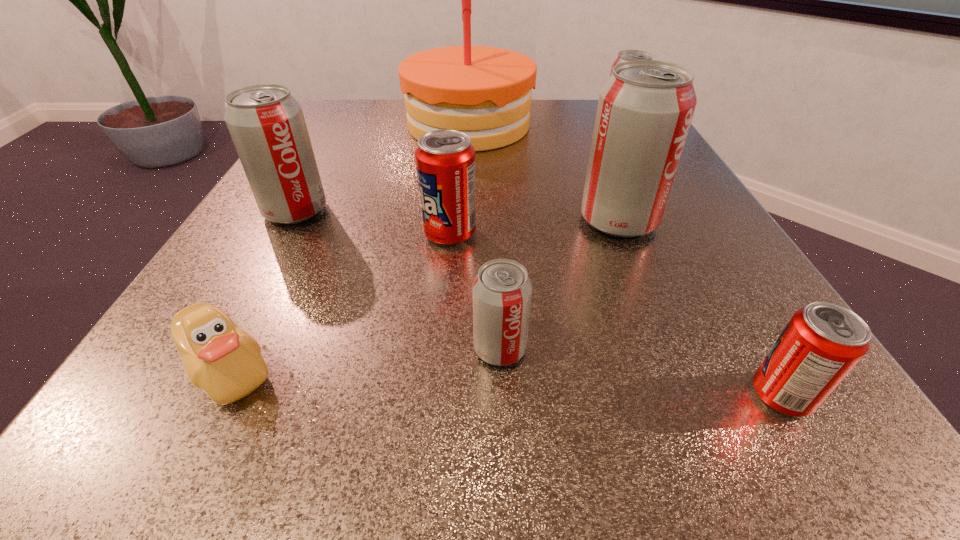
Where is `vacant position located 0.100m on the back of the right red soda can`? Image resolution: width=960 pixels, height=540 pixels. vacant position located 0.100m on the back of the right red soda can is located at coordinates (731, 308).

This screenshot has height=540, width=960. Identify the location of free location located on the front of the nearest gray soda can. (503, 417).

You are a GUI agent. You are given a task and a screenshot of the screen. Output one action in this format:
    pyautogui.click(x=<x>, y=<y>)
    Task: Click on the birthday cake that is at the far edge
    The height and width of the screenshot is (540, 960).
    Given the screenshot: What is the action you would take?
    pyautogui.click(x=485, y=92)

Where is `soda can located in the far edge section of the desktop`? soda can located in the far edge section of the desktop is located at coordinates (626, 55).

Find the location of a particular element. soda can located at the near edge is located at coordinates (822, 342).

You are a GUI agent. You are given a task and a screenshot of the screen. Output one action in this format:
    pyautogui.click(x=<x>, y=<y>)
    Task: Click on the duck that is at the near edge
    
    Given the screenshot: What is the action you would take?
    pyautogui.click(x=220, y=358)

Where is `soda can at the left edge`? This screenshot has height=540, width=960. soda can at the left edge is located at coordinates (266, 123).

Locate an element on the screen. duck present at the left edge is located at coordinates (220, 358).

You are a GUI agent. You are given a task and a screenshot of the screen. Output one action in this format:
    pyautogui.click(x=<x>, y=<y>)
    Task: Click on the object that is at the near left corner
    The width and height of the screenshot is (960, 540).
    Given the screenshot: What is the action you would take?
    [x=220, y=358]

Locate an element on the screen. object present at the far right corner is located at coordinates (626, 55).